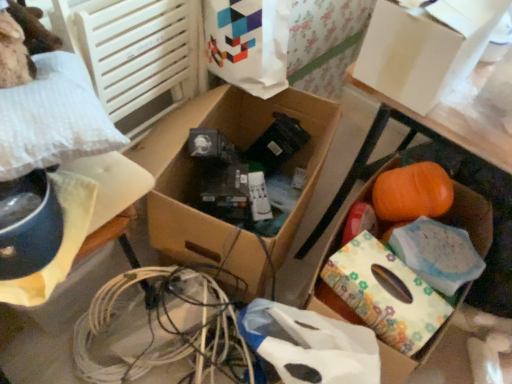
Question: Is white plastic bag at left, the fourth storage box viewed from the right, wider or thinner than cardboard box at center, positioned as the 3th storage box in right-to-left order?

Choices:
 (A) thin
 (B) wide

Answer: (A)

Question: In the image, is white plastic bag at left, the fourth storage box viewed from the right, positioned in front of or behind cardboard box at center, positioned as the 3th storage box in right-to-left order?

Choices:
 (A) front
 (B) behind

Answer: (A)

Question: Which object is positioned closest to the white plastic bag at left, the first storage box when ordered from left to right?

Choices:
 (A) white matte wrapping paper at lower center
 (B) floral-patterned paper at lower right
 (C) white paper bag at upper center
 (D) orange matte pumpkin at center, the fourth storage box positioned from the left
 (E) white cardboard box at upper right, the 2th storage box viewed from the right

Answer: (A)

Question: Which is nearer to the white plastic bag at left, the first storage box when ordered from left to right?

Choices:
 (A) white matte wrapping paper at lower center
 (B) orange matte pumpkin at center, which is counted as the 1th storage box, starting from the right
 (C) floral-patterned paper at lower right
 (D) cardboard box at center, arranged as the 2th storage box when viewed from the left
 (E) white cardboard box at upper right, the 2th storage box viewed from the right

Answer: (D)